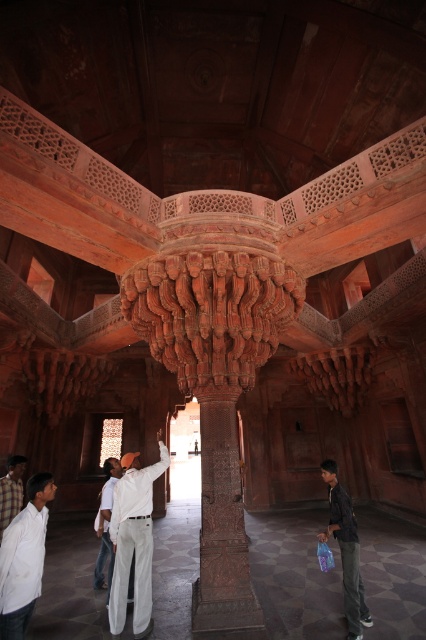
Question: Which object is the closest to the white matte shirt at center?

Choices:
 (A) carved stone column at center
 (B) dark gray jeans at lower right
 (C) light brown fabric shirt at center

Answer: (A)

Question: Can you confirm if white cotton pants at center is positioned to the left of white matte shirt at center?

Choices:
 (A) yes
 (B) no

Answer: (B)

Question: Which point is farther from the camera taking this photo?

Choices:
 (A) (51, 490)
 (B) (8, 515)
 (C) (218, 573)

Answer: (B)

Question: Can you confirm if carved stone column at center is thinner than white matte shirt at center?

Choices:
 (A) yes
 (B) no

Answer: (B)

Question: Which of the following is the closest to the observer?

Choices:
 (A) (34, 593)
 (B) (336, 536)
 (C) (196, 616)
 (D) (129, 483)

Answer: (A)

Question: Is white cotton pants at center to the left of white matte shirt at center from the viewer's perspective?

Choices:
 (A) yes
 (B) no

Answer: (B)